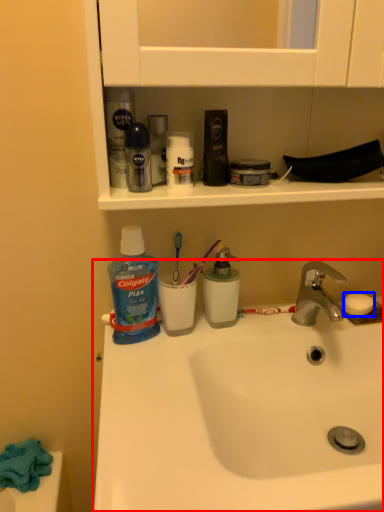
Question: Which of the following is the farthest to the observer, sink (highlighted by a red box) or soap (highlighted by a blue box)?

Choices:
 (A) sink
 (B) soap

Answer: (B)